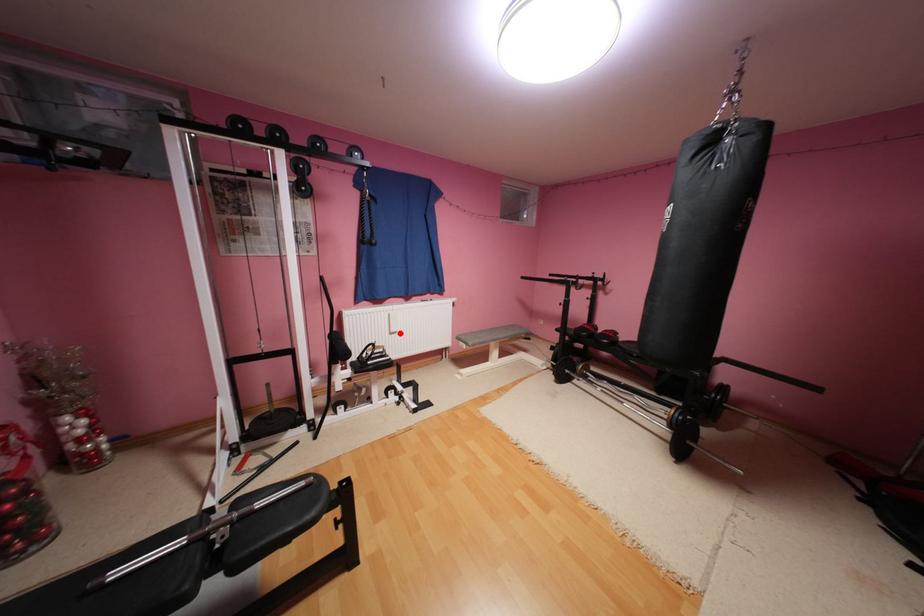
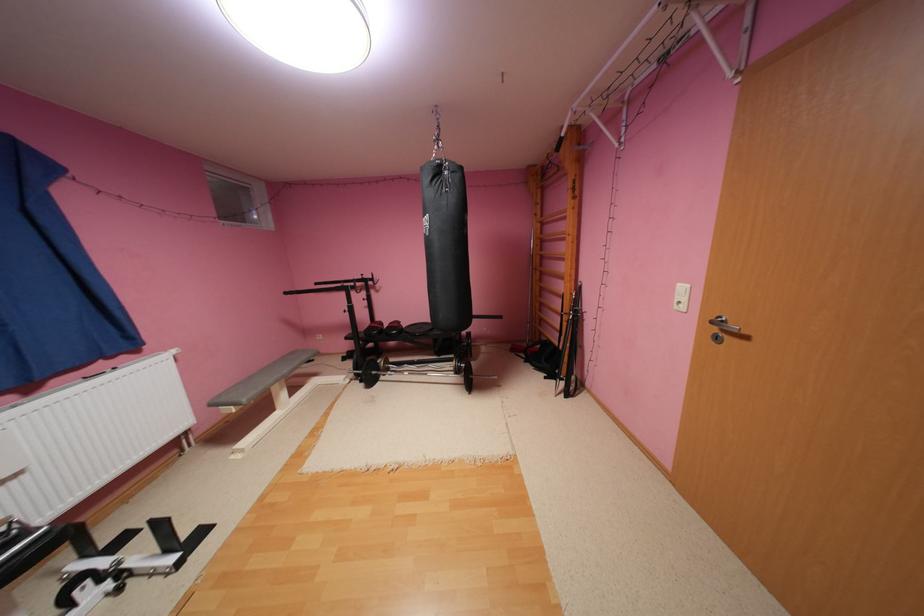
Question: A red point is marked in image1. In image2, is the corresponding 3D point closer to the camera or farther? Reply with the corresponding letter.

Choices:
 (A) The corresponding 3D point is closer.
 (B) The corresponding 3D point is farther.

Answer: (B)